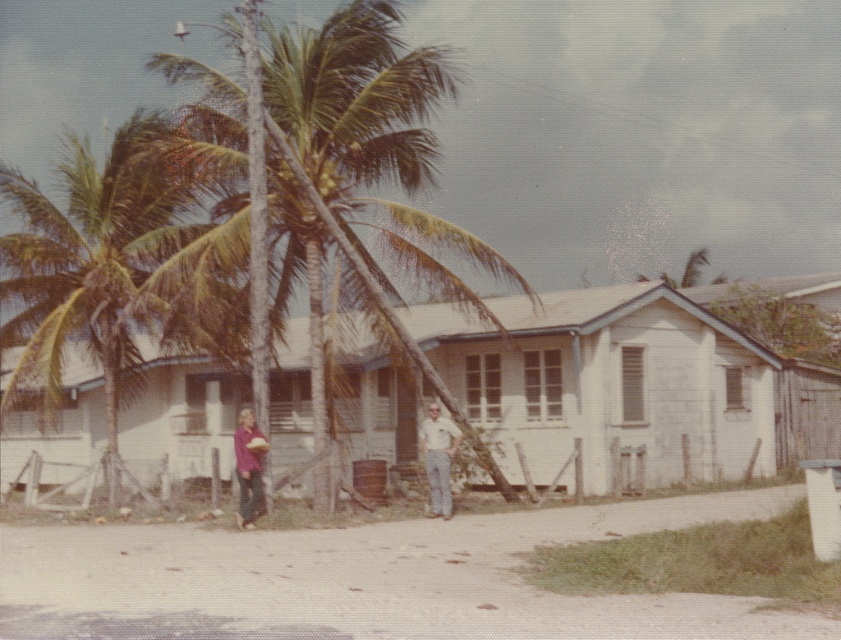
Does white cotton shirt at center have a greater height compared to matte purple shirt at center?

Indeed, white cotton shirt at center has a greater height compared to matte purple shirt at center.

Does white cotton shirt at center appear over matte purple shirt at center?

Indeed, white cotton shirt at center is positioned over matte purple shirt at center.

Locate an element on the screen. Image resolution: width=841 pixels, height=640 pixels. white cotton shirt at center is located at coordinates (438, 458).

Locate an element on the screen. white cotton shirt at center is located at coordinates (438, 458).

Between green leafy palm tree at center and matte purple shirt at center, which one appears on the left side from the viewer's perspective?

green leafy palm tree at center is more to the left.

Does green leafy palm tree at center appear over matte purple shirt at center?

Yes, green leafy palm tree at center is above matte purple shirt at center.

Does point (110, 483) come in front of point (241, 436)?

That is False.

You are a GUI agent. You are given a task and a screenshot of the screen. Output one action in this format:
    pyautogui.click(x=<x>, y=<y>)
    Task: Click on the green leafy palm tree at center
    
    Given the screenshot: What is the action you would take?
    pyautogui.click(x=106, y=269)

Between point (665, 428) and point (233, 436), which one is positioned behind?

The point (665, 428) is more distant.

Does white wood house at center have a greater height compared to matte purple shirt at center?

Indeed, white wood house at center has a greater height compared to matte purple shirt at center.

Is point (652, 461) positioned in front of point (246, 460)?

No, (652, 461) is behind (246, 460).

Find the location of a particular element. The width and height of the screenshot is (841, 640). white wood house at center is located at coordinates (628, 388).